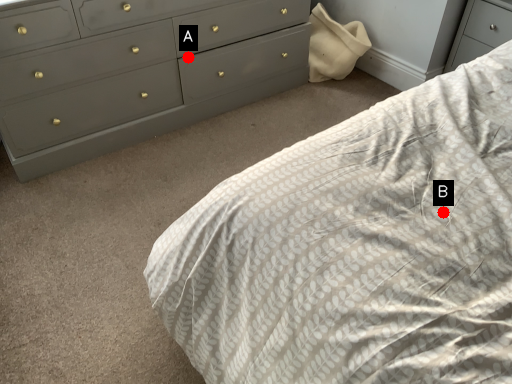
Question: Two points are circled on the image, labeled by A and B beside each circle. Among these points, which one is farthest from the camera?

Choices:
 (A) A is further
 (B) B is further

Answer: (A)